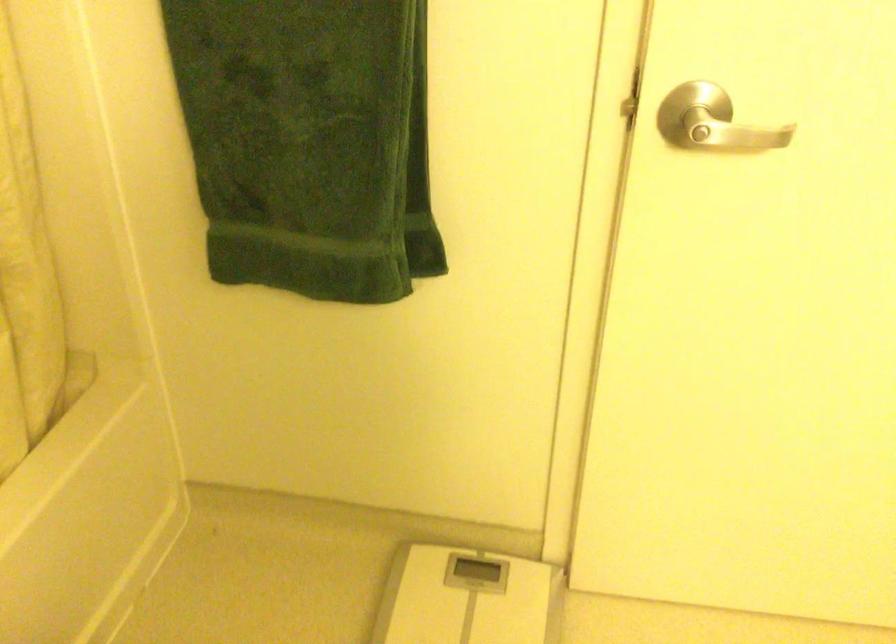
The height and width of the screenshot is (644, 896). What do you see at coordinates (730, 134) in the screenshot? I see `the silver door handle` at bounding box center [730, 134].